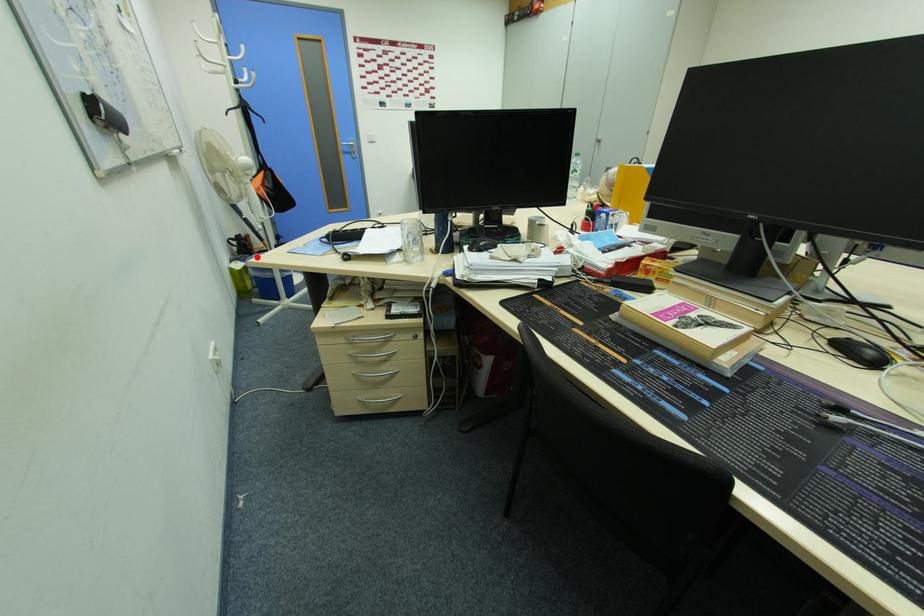
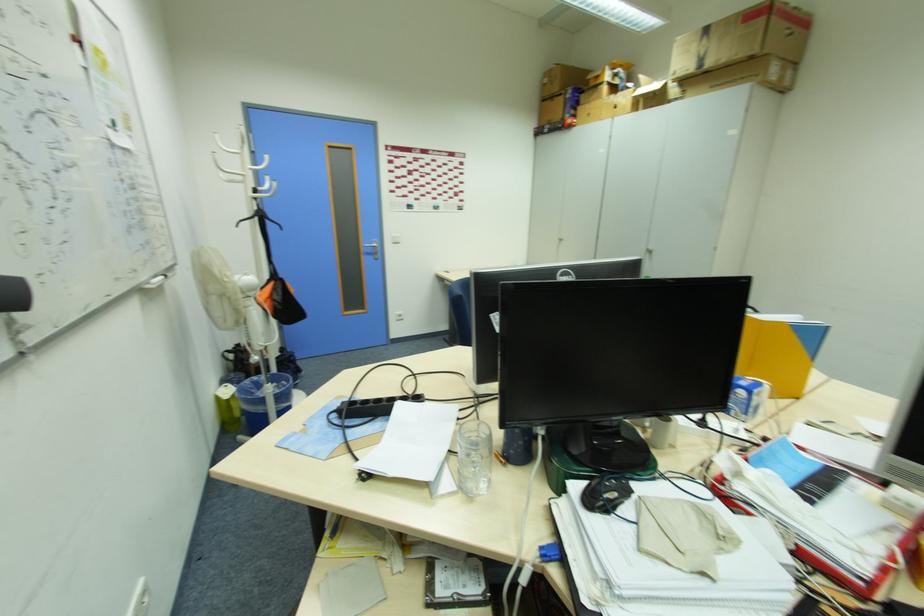
Question: I am providing you with two images of the same scene from different viewpoints. A red point is marked on the first image. Can you still see the location of the red point in image 2?

Choices:
 (A) Yes
 (B) No

Answer: (A)